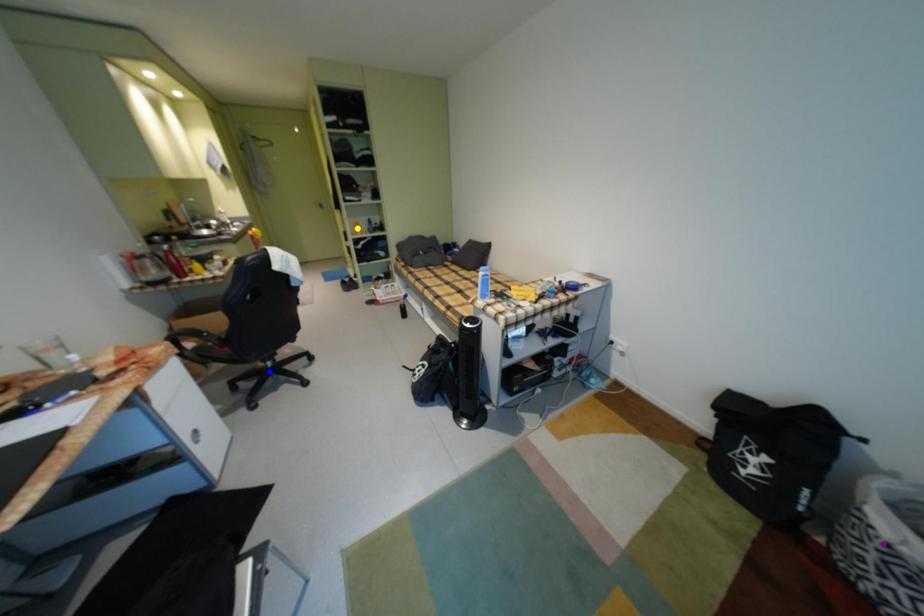
Order these from nearest to farthest:
1. yellow point
2. blue point
3. purple point

purple point → blue point → yellow point